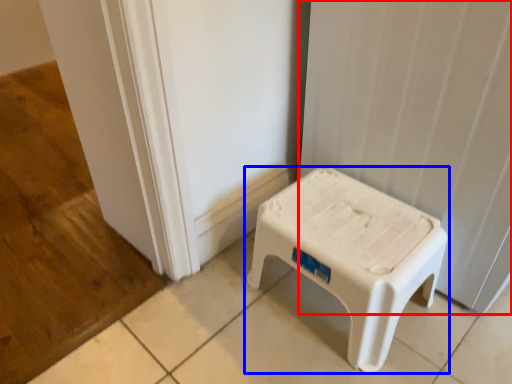
Question: Which of the following is the closest to the observer, curtain (highlighted by a red box) or stool (highlighted by a blue box)?

Choices:
 (A) curtain
 (B) stool

Answer: (A)